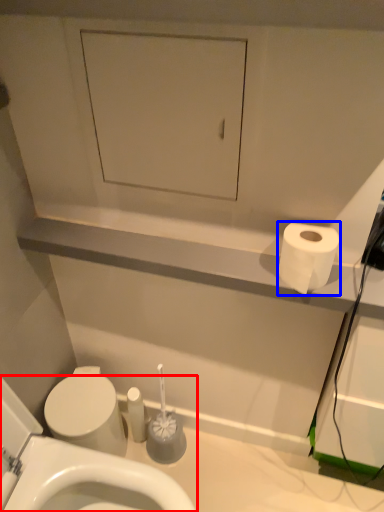
Question: Which point is closer to the camera, toilet (highlighted by a red box) or toilet paper (highlighted by a blue box)?

Choices:
 (A) toilet
 (B) toilet paper

Answer: (A)